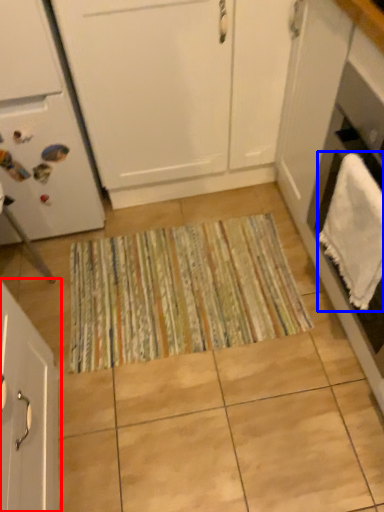
Question: Which object is closer to the camera taking this photo, cabinetry (highlighted by a red box) or bath towel (highlighted by a blue box)?

Choices:
 (A) cabinetry
 (B) bath towel

Answer: (A)